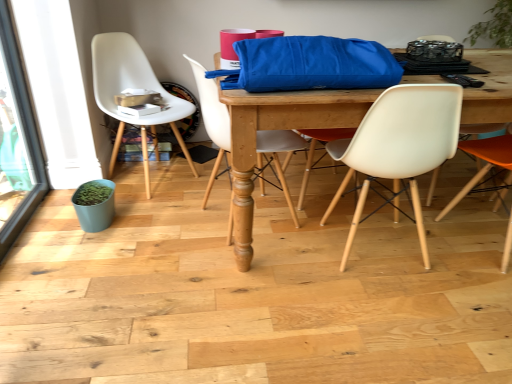
Question: Can you confirm if matte blue flowerpot at lower left is taller than black plastic remote control at upper right?

Choices:
 (A) no
 (B) yes

Answer: (B)

Question: Are matte blue flowerpot at lower left and black plastic remote control at upper right beside each other?

Choices:
 (A) no
 (B) yes

Answer: (A)

Question: Is matte blue flowerpot at lower left far from black plastic remote control at upper right?

Choices:
 (A) yes
 (B) no

Answer: (A)

Question: Would you say black plastic remote control at upper right is part of matte blue flowerpot at lower left's contents?

Choices:
 (A) no
 (B) yes

Answer: (A)

Question: From a real-world perspective, is matte blue flowerpot at lower left beneath black plastic remote control at upper right?

Choices:
 (A) no
 (B) yes

Answer: (B)

Question: Does matte blue flowerpot at lower left have a greater width compared to black plastic remote control at upper right?

Choices:
 (A) no
 (B) yes

Answer: (B)

Question: Is black plastic remote control at upper right in front of matte white chair at center, positioned as the 2th chair in left-to-right order?

Choices:
 (A) no
 (B) yes

Answer: (A)

Question: Does black plastic remote control at upper right have a lesser width compared to matte white chair at center, positioned as the 2th chair in left-to-right order?

Choices:
 (A) no
 (B) yes

Answer: (B)

Question: From a real-world perspective, is black plastic remote control at upper right positioned under matte white chair at center, positioned as the 2th chair in left-to-right order, based on gravity?

Choices:
 (A) no
 (B) yes

Answer: (A)

Question: Can you see black plastic remote control at upper right touching matte white chair at center, which is counted as the 3th chair, starting from the right?

Choices:
 (A) yes
 (B) no

Answer: (B)

Question: From a real-world perspective, is black plastic remote control at upper right located higher than matte white chair at center, positioned as the 2th chair in left-to-right order?

Choices:
 (A) no
 (B) yes

Answer: (B)

Question: Is black plastic remote control at upper right positioned with its back to matte white chair at center, which is counted as the 3th chair, starting from the right?

Choices:
 (A) no
 (B) yes

Answer: (A)

Question: Can black plastic remote control at upper right be found inside blue fabric bag at center?

Choices:
 (A) no
 (B) yes

Answer: (B)